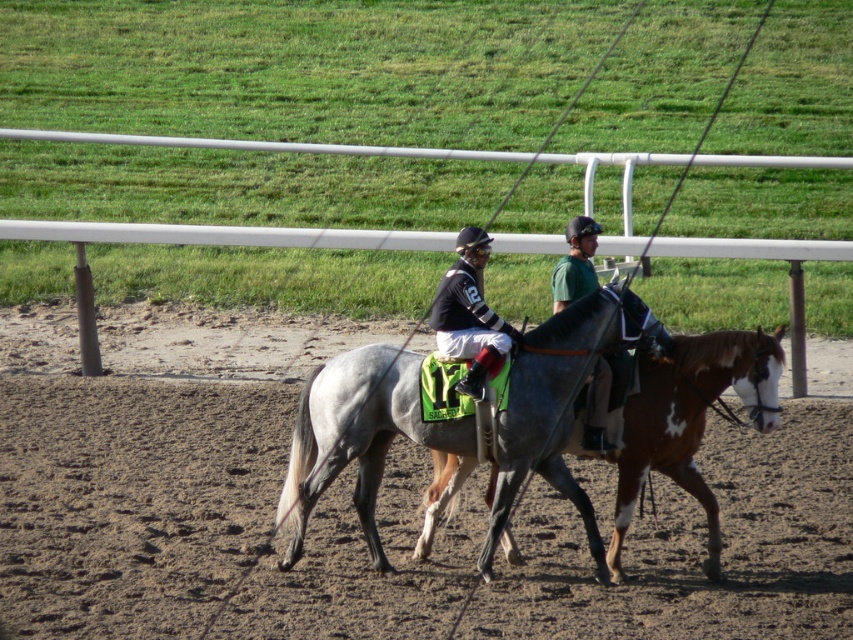
Question: Which point is farther to the camera?

Choices:
 (A) (479, 236)
 (B) (296, 442)
 (C) (599, 380)

Answer: (A)

Question: Does dirt at center have a greater width compared to shiny black horse at center?

Choices:
 (A) yes
 (B) no

Answer: (A)

Question: Which point is farther to the camera?

Choices:
 (A) (653, 396)
 (B) (729, 570)
 (C) (576, 216)
 (D) (465, 266)

Answer: (C)

Question: Considering the real-world distances, which object is closest to the matte black jockey at center?

Choices:
 (A) shiny black horse at center
 (B) gray matte/satin horse at center

Answer: (A)

Question: Is gray glossy horse at center positioned behind shiny black horse at center?

Choices:
 (A) yes
 (B) no

Answer: (B)

Question: Does matte black jockey at center have a smaller size compared to shiny black horse at center?

Choices:
 (A) no
 (B) yes

Answer: (A)